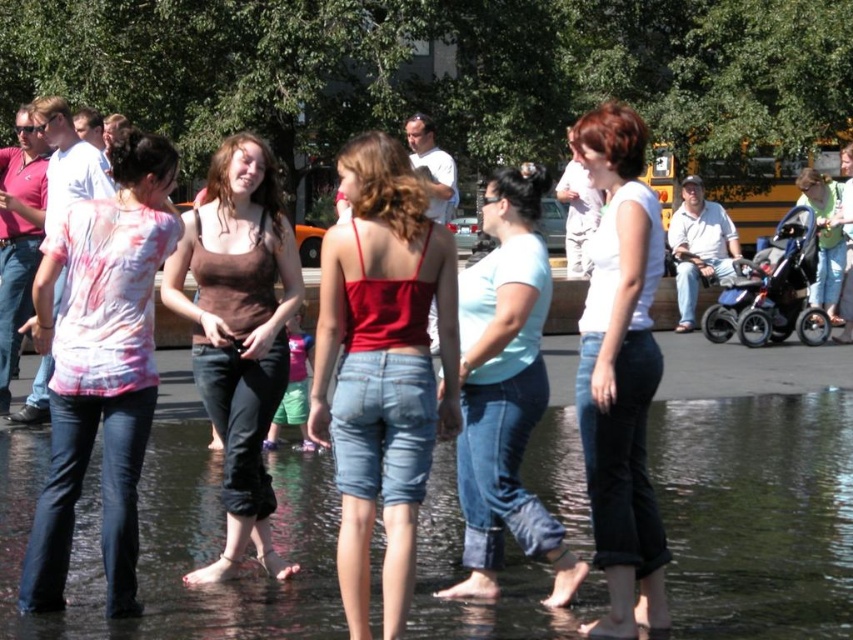
Does white cotton shirt at center have a greater width compared to light green cotton shirt at center?

In fact, white cotton shirt at center might be narrower than light green cotton shirt at center.

Who is more forward, (599, 172) or (833, 216)?

Point (599, 172) is in front.

Identify the location of white cotton shirt at center. (619, 371).

Image resolution: width=853 pixels, height=640 pixels. Identify the location of white cotton shirt at center. (619, 371).

Can you confirm if clear water at center is smaller than brown cotton tank top at center?

Yes.

Does clear water at center come behind brown cotton tank top at center?

Yes, clear water at center is further from the viewer.

Is point (47, 449) farther from camera compared to point (201, 388)?

Yes, it is behind point (201, 388).

Locate an element on the screen. The image size is (853, 640). clear water at center is located at coordinates (757, 513).

Is matte red tank top at center to the left of light blue denim jeans at center from the viewer's perspective?

Correct, you'll find matte red tank top at center to the left of light blue denim jeans at center.

Is point (318, 342) farther from camera compared to point (495, 349)?

No, it is not.

Measure the distance between point (343,353) and camera.

A distance of 17.10 feet exists between point (343,353) and camera.

Where is `matte red tank top at center`? matte red tank top at center is located at coordinates (381, 368).